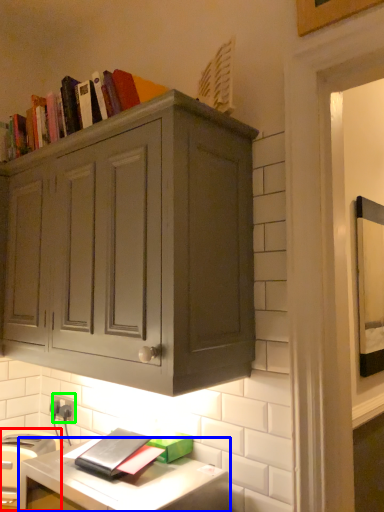
Question: Which is farther away from appliance (highlighted by a red box)? computer desk (highlighted by a blue box) or electric outlet (highlighted by a green box)?

Choices:
 (A) computer desk
 (B) electric outlet

Answer: (B)